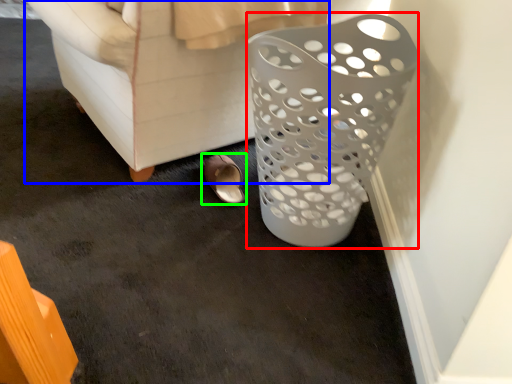
Question: Based on their relative distances, which object is farther from basket (highlighted by a red box)? Choose from furniture (highlighted by a blue box) and footwear (highlighted by a green box).

Choices:
 (A) furniture
 (B) footwear

Answer: (B)